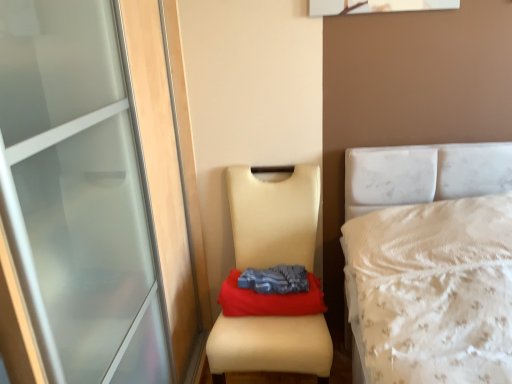
Where is `vacant space situated above blue fabric at center (from a real-world perspective)`? vacant space situated above blue fabric at center (from a real-world perspective) is located at coordinates (259, 280).